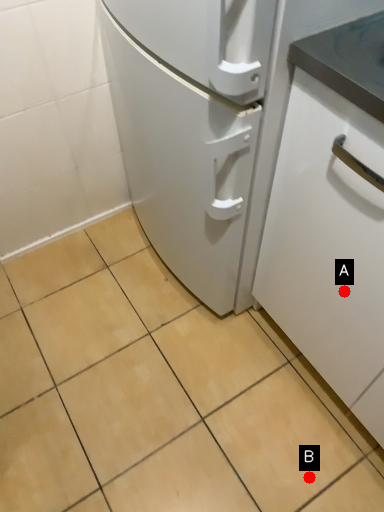
Question: Two points are circled on the image, labeled by A and B beside each circle. Among these points, which one is nearest to the camera?

Choices:
 (A) A is closer
 (B) B is closer

Answer: (A)